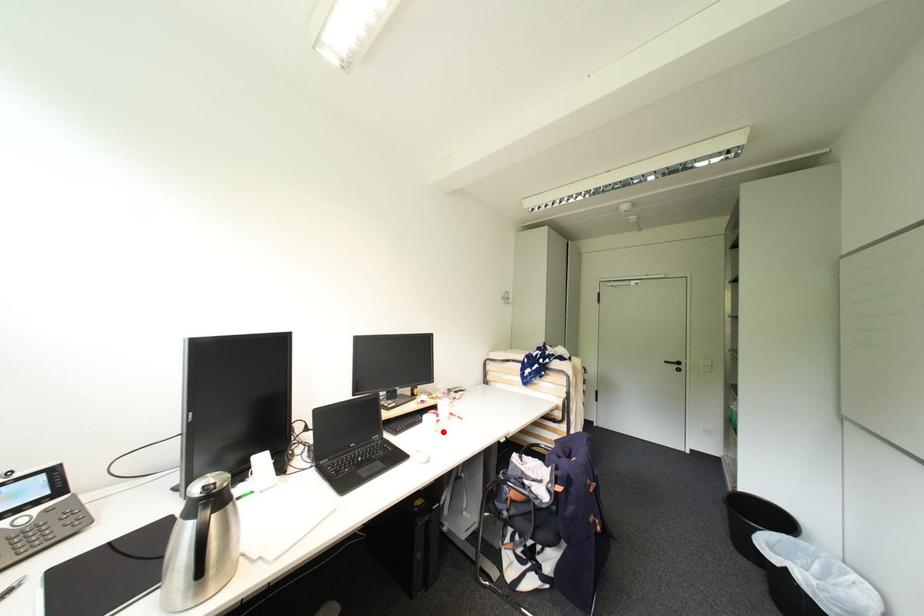
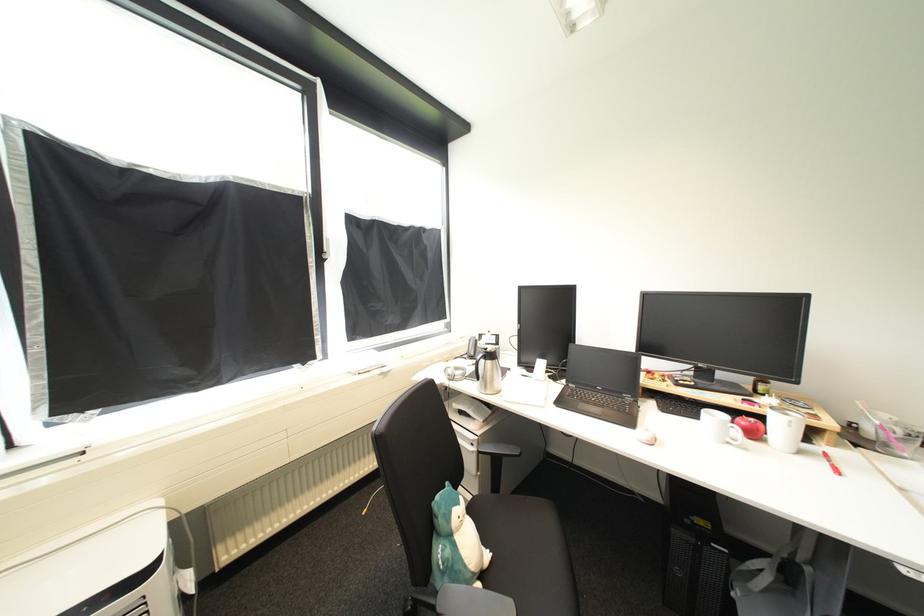
Question: I am providing you with two images of the same scene from different viewpoints. A red point is marked on the first image. At the location where the point appears in image 1, is it still visible in image 2?

Choices:
 (A) Yes
 (B) No

Answer: (A)